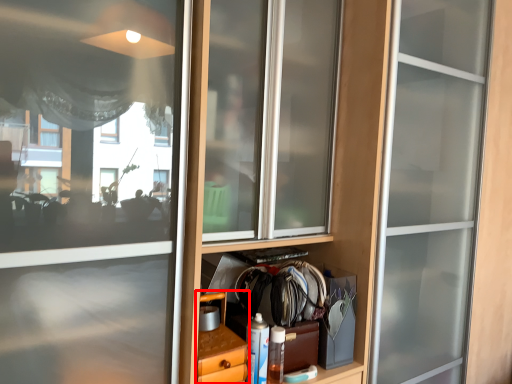
Question: Where is cabinetry (annotated by the red box) located in relation to bottle in the image?

Choices:
 (A) right
 (B) left

Answer: (B)